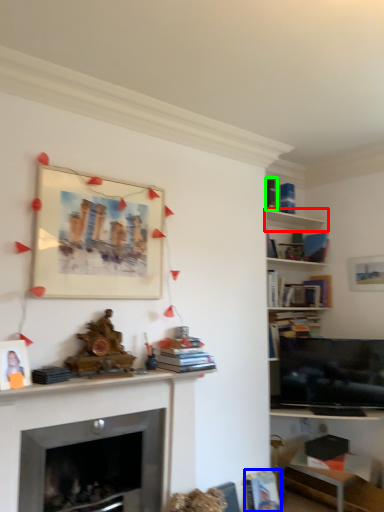
Question: Which object is the closest to the shelf (highlighted by a red box)? Choose among these: book (highlighted by a blue box) or book (highlighted by a green box).

Choices:
 (A) book
 (B) book

Answer: (B)